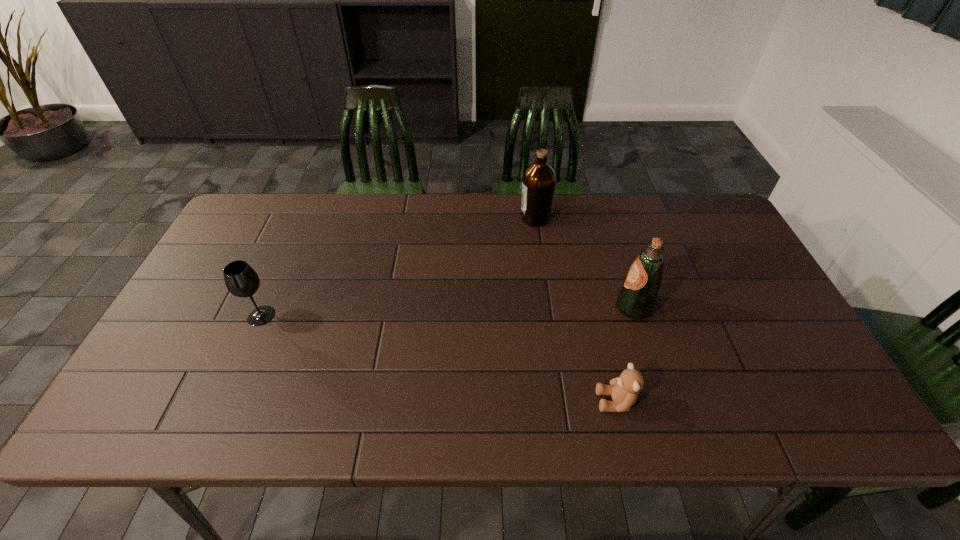
At what (x,y) coordinates should I click in order to perform the action: click on the third object from right to left. Please return your answer as a coordinate pair (x, y). Looking at the image, I should click on (539, 179).

I want to click on the farthest object, so click(539, 179).

Image resolution: width=960 pixels, height=540 pixels. What are the coordinates of `the rightmost object` in the screenshot? It's located at (636, 299).

You are a GUI agent. You are given a task and a screenshot of the screen. Output one action in this format:
    pyautogui.click(x=<x>, y=<y>)
    Task: Click on the right olive oil
    The width and height of the screenshot is (960, 540).
    Given the screenshot: What is the action you would take?
    pos(636,299)

The height and width of the screenshot is (540, 960). Identify the location of the leftmost object. (241, 280).

The height and width of the screenshot is (540, 960). In order to click on the third tallest object in this screenshot , I will do `click(241, 280)`.

This screenshot has height=540, width=960. I want to click on the second object from right to left, so click(624, 390).

The image size is (960, 540). I want to click on teddy bear, so click(624, 390).

At what (x,y) coordinates should I click in order to perform the action: click on free space located on the label of the farthest object. Please return your answer as a coordinate pair (x, y). Looking at the image, I should click on (467, 218).

Locate an element on the screen. This screenshot has width=960, height=540. free space located on the label of the farthest object is located at coordinates (457, 218).